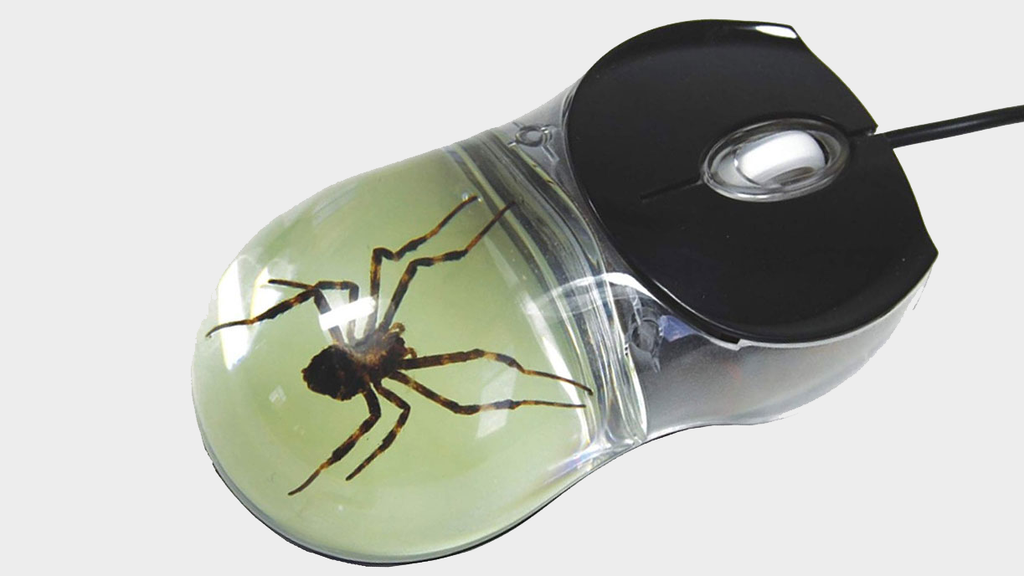
Find the location of a particular element. computer mouse is located at coordinates (544, 263).